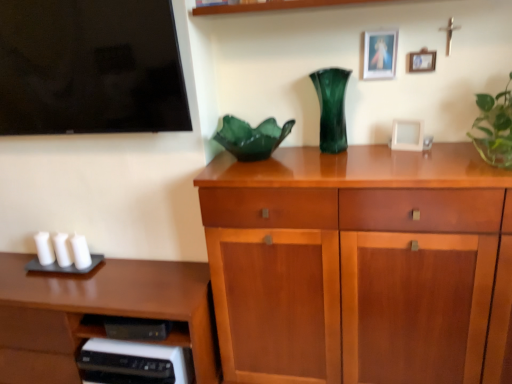
Find the location of a particular element. free space to the right of green glass vase at center is located at coordinates (373, 145).